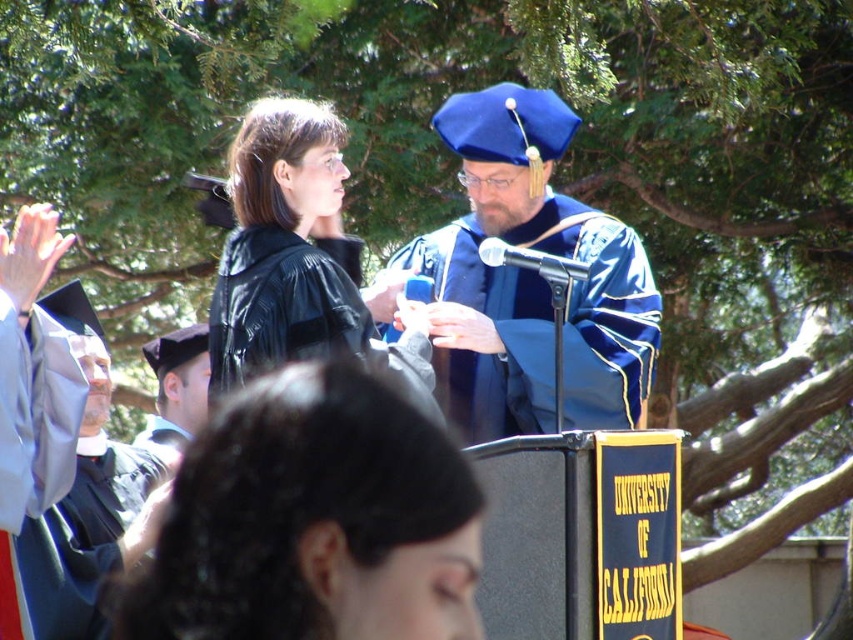
From the picture: Between black matte graduation gown at center and blue satin graduation gown at center, which one is positioned higher?

Positioned higher is blue satin graduation gown at center.

Does point (329, 449) come farther from viewer compared to point (634, 234)?

No, (329, 449) is closer to viewer.

I want to click on black matte graduation gown at center, so click(312, 520).

Does blue satin graduation gown at center have a greater height compared to matte black graduation cap at left?

Correct, blue satin graduation gown at center is much taller as matte black graduation cap at left.

You are a GUI agent. You are given a task and a screenshot of the screen. Output one action in this format:
    pyautogui.click(x=<x>, y=<y>)
    Task: Click on the blue satin graduation gown at center
    
    Given the screenshot: What is the action you would take?
    pyautogui.click(x=531, y=280)

The image size is (853, 640). Describe the element at coordinates (531, 280) in the screenshot. I see `blue satin graduation gown at center` at that location.

Where is `blue satin graduation gown at center`? blue satin graduation gown at center is located at coordinates (531, 280).

Who is shorter, matte black gown at upper left or matte black graduation gown at left?

matte black gown at upper left is shorter.

Is point (335, 236) positioned after point (90, 362)?

That is False.

Is point (305, 340) less distant than point (103, 432)?

Yes, point (305, 340) is in front of point (103, 432).

The height and width of the screenshot is (640, 853). In order to click on matte black gown at upper left in this screenshot , I will do `click(296, 257)`.